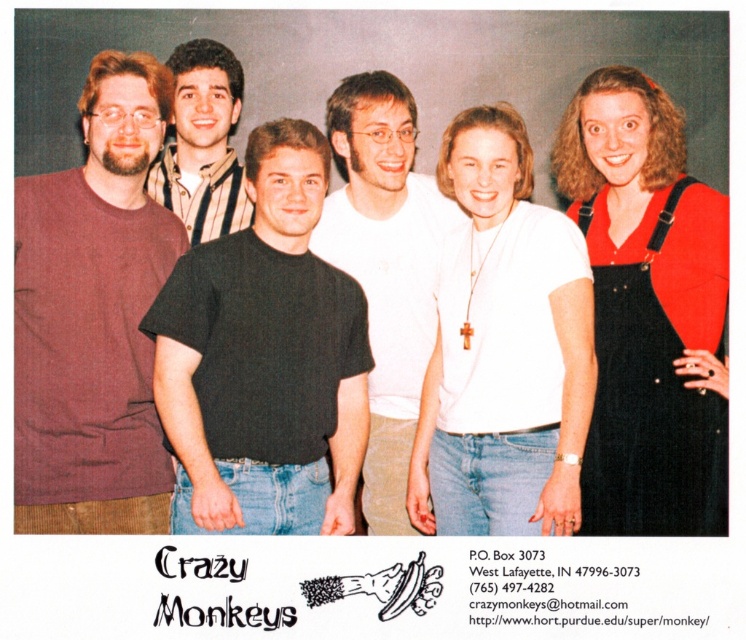
How much distance is there between white matte shirt at center and black corduroy overalls at right?

white matte shirt at center is 11.16 inches from black corduroy overalls at right.

Does point (480, 515) come behind point (630, 272)?

Yes, point (480, 515) is farther from viewer.

Where is `white matte shirt at center`? The image size is (746, 640). white matte shirt at center is located at coordinates (504, 349).

Between black cotton t-shirt at center and white matte t-shirt at center, which one appears on the right side from the viewer's perspective?

Positioned to the right is white matte t-shirt at center.

Image resolution: width=746 pixels, height=640 pixels. Describe the element at coordinates (263, 358) in the screenshot. I see `black cotton t-shirt at center` at that location.

Does point (280, 200) come in front of point (319, 224)?

Yes, it is.

In order to click on black cotton t-shirt at center in this screenshot , I will do `click(263, 358)`.

Between point (495, 416) and point (210, 212), which one is positioned in front?

Positioned in front is point (495, 416).

Image resolution: width=746 pixels, height=640 pixels. Describe the element at coordinates (504, 349) in the screenshot. I see `white matte shirt at center` at that location.

Locate an element on the screen. Image resolution: width=746 pixels, height=640 pixels. white matte shirt at center is located at coordinates (504, 349).